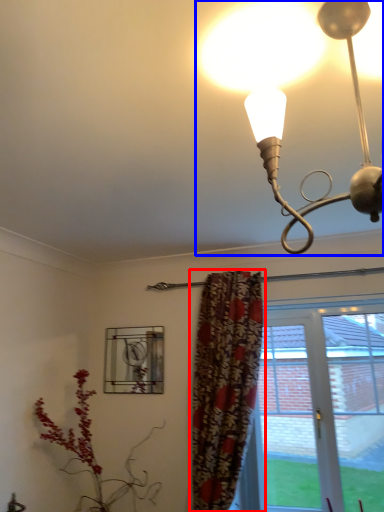
Question: Which object is further to the camera taking this photo, curtain (highlighted by a red box) or lamp (highlighted by a blue box)?

Choices:
 (A) curtain
 (B) lamp

Answer: (A)